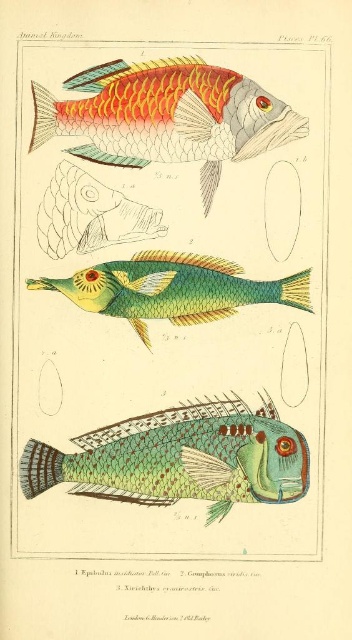
Question: Can you confirm if green textured fish at lower center is positioned below shiny orange scales at upper center?

Choices:
 (A) no
 (B) yes

Answer: (B)

Question: Considering the real-world distances, which object is closest to the green iridescent fish at center?

Choices:
 (A) green textured fish at upper center
 (B) shiny orange scales at upper center

Answer: (A)

Question: Can you confirm if green textured fish at lower center is positioned to the left of shiny orange scales at upper center?

Choices:
 (A) yes
 (B) no

Answer: (A)

Question: Which object appears farthest from the camera in this image?

Choices:
 (A) green textured fish at lower center
 (B) green textured fish at upper center

Answer: (A)

Question: Which of the following is the farthest from the observer?

Choices:
 (A) green iridescent fish at center
 (B) shiny orange scales at upper center
 (C) green textured fish at lower center
 (D) green textured fish at upper center

Answer: (A)

Question: Is green textured fish at upper center closer to the viewer compared to green textured fish at lower center?

Choices:
 (A) no
 (B) yes

Answer: (B)